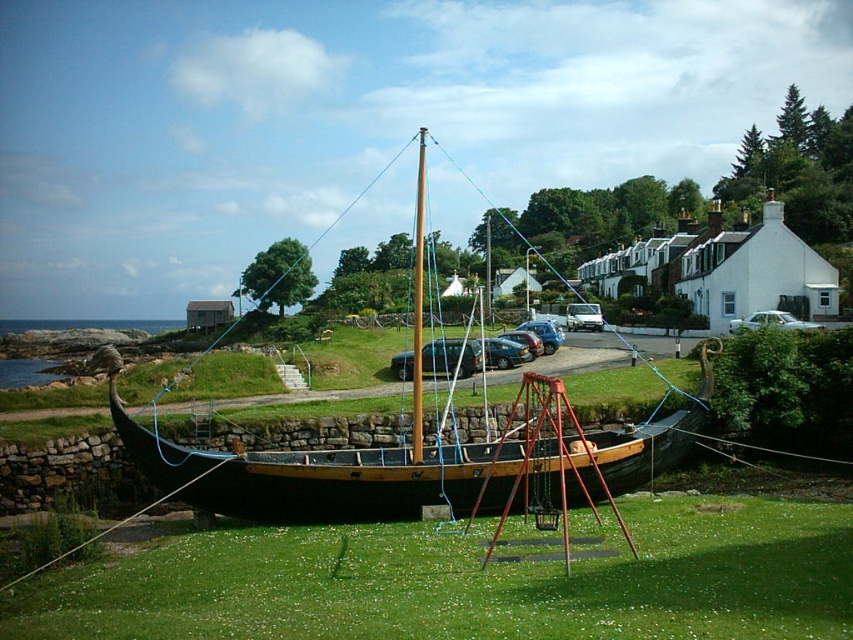
Who is positioned more to the right, wooden mast at center or white matte sedan at center?

Positioned to the right is white matte sedan at center.

Can you confirm if wooden mast at center is bigger than white matte sedan at center?

Indeed, wooden mast at center has a larger size compared to white matte sedan at center.

The width and height of the screenshot is (853, 640). What do you see at coordinates (418, 305) in the screenshot?
I see `wooden mast at center` at bounding box center [418, 305].

The image size is (853, 640). I want to click on wooden mast at center, so click(418, 305).

Which is above, wooden sailboat at center or white matte sedan at center?

white matte sedan at center

Does wooden sailboat at center have a greater width compared to white matte sedan at center?

Correct, the width of wooden sailboat at center exceeds that of white matte sedan at center.

Does point (677, 445) come closer to viewer compared to point (799, 323)?

Yes, it is in front of point (799, 323).

Locate an element on the screen. This screenshot has width=853, height=640. wooden sailboat at center is located at coordinates (410, 468).

Can you confirm if green grass at lower center is positioned above wooden sailboat at center?

Actually, green grass at lower center is below wooden sailboat at center.

Between point (537, 632) and point (355, 499), which one is positioned behind?

Point (355, 499)

Which is behind, point (491, 596) or point (312, 460)?

The point (312, 460) is behind.

This screenshot has width=853, height=640. Identify the location of green grass at lower center. (469, 582).